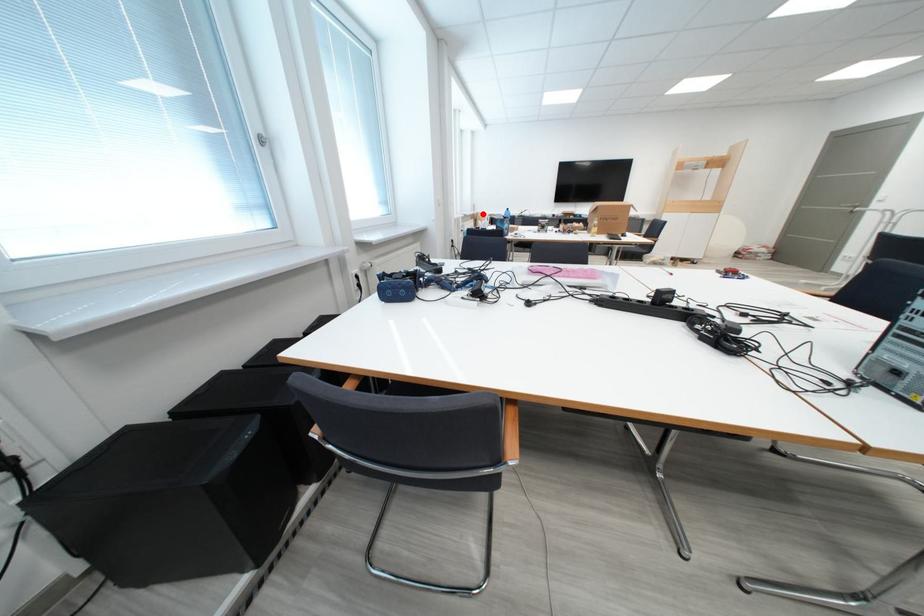
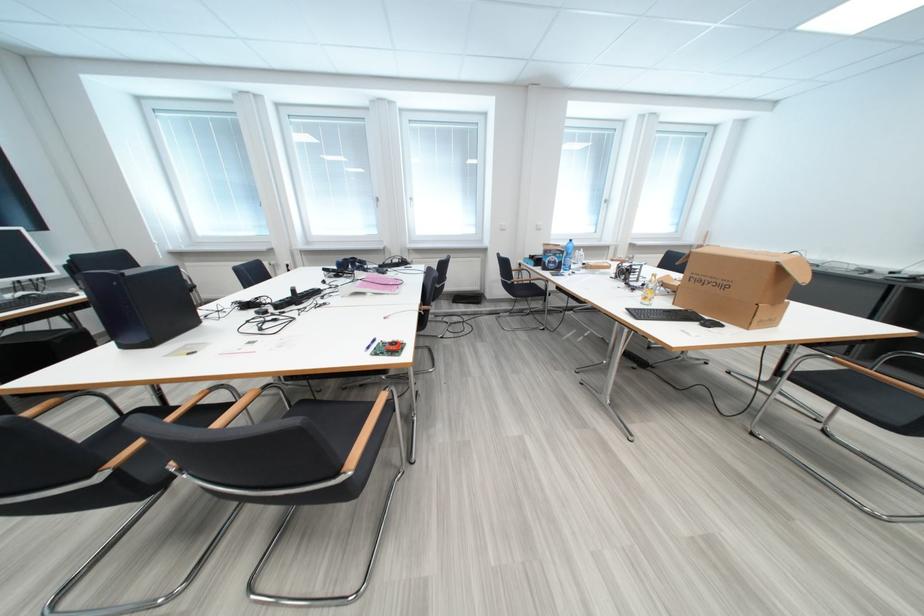
In the second image, find the point that corresponds to the highlighted location in the first image.

(711, 245)